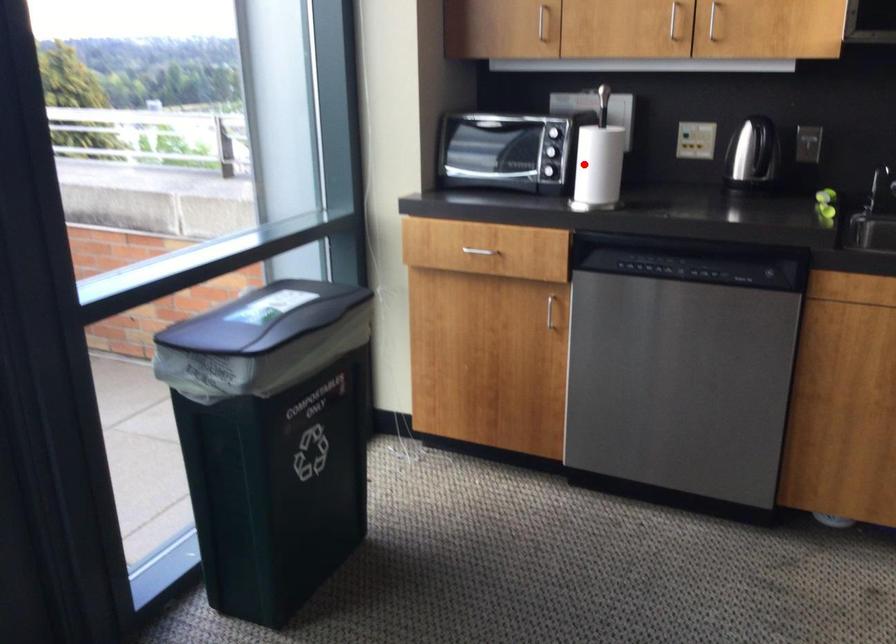
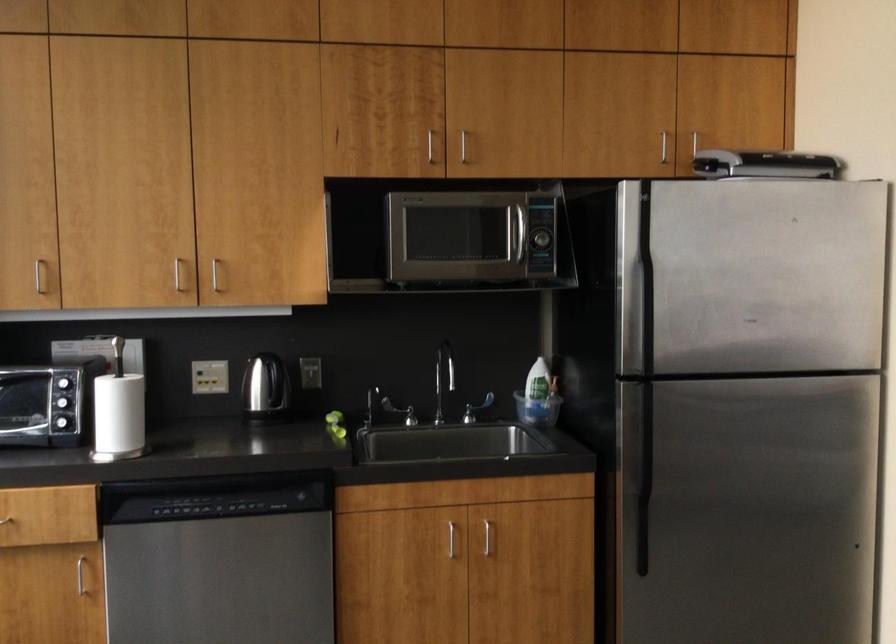
Locate, in the second image, the point that corresponds to the highlighted location in the first image.

(117, 415)